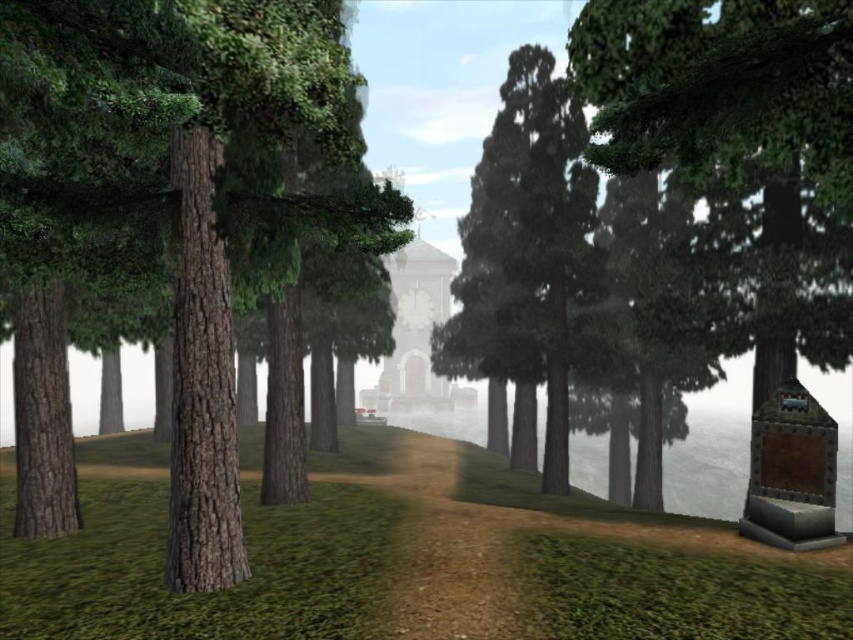
Question: Which is farther from the green matte tree at center?

Choices:
 (A) green textured tree at right
 (B) smooth brown tree trunk at left

Answer: (A)

Question: Among these points, which one is farthest from the camera?

Choices:
 (A) (53, 147)
 (B) (721, 148)

Answer: (A)

Question: Does smooth brown tree trunk at left have a greater width compared to green textured tree at right?

Choices:
 (A) yes
 (B) no

Answer: (B)

Question: Does smooth brown tree trunk at left appear under green matte tree at center?

Choices:
 (A) yes
 (B) no

Answer: (A)

Question: Based on their relative distances, which object is nearer to the green matte tree at center?

Choices:
 (A) green textured tree at right
 (B) smooth brown tree trunk at left

Answer: (B)

Question: Is smooth brown tree trunk at left bigger than green textured tree at right?

Choices:
 (A) yes
 (B) no

Answer: (B)